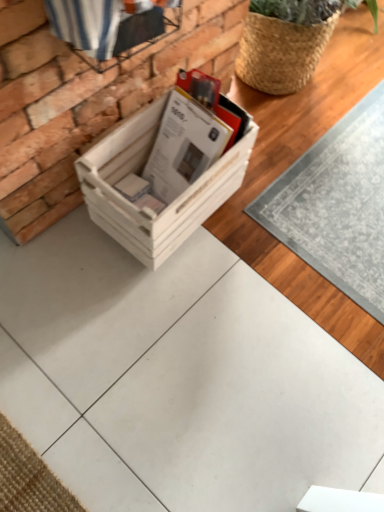
The height and width of the screenshot is (512, 384). What are the coordinates of `vacant area to the right of white wood crate at center` in the screenshot? It's located at (265, 208).